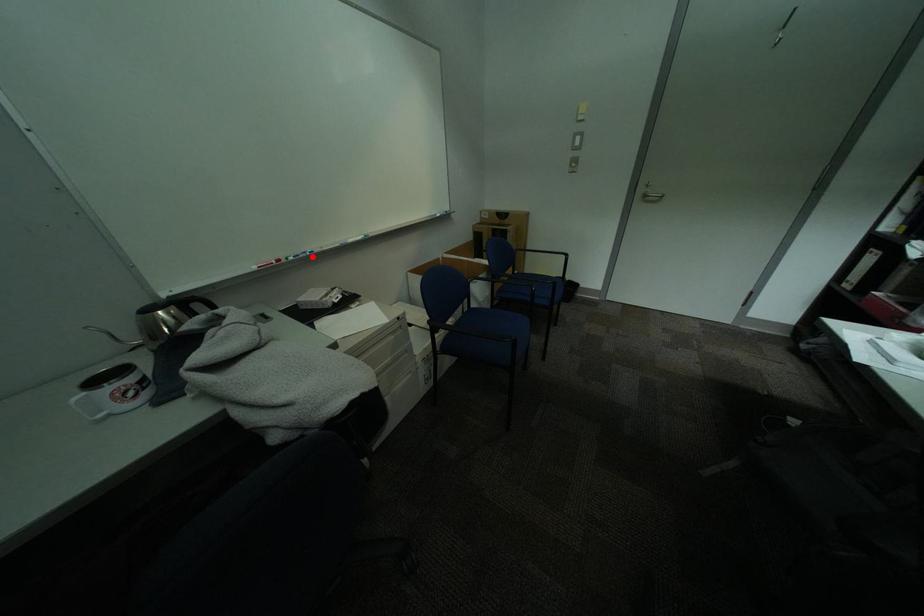
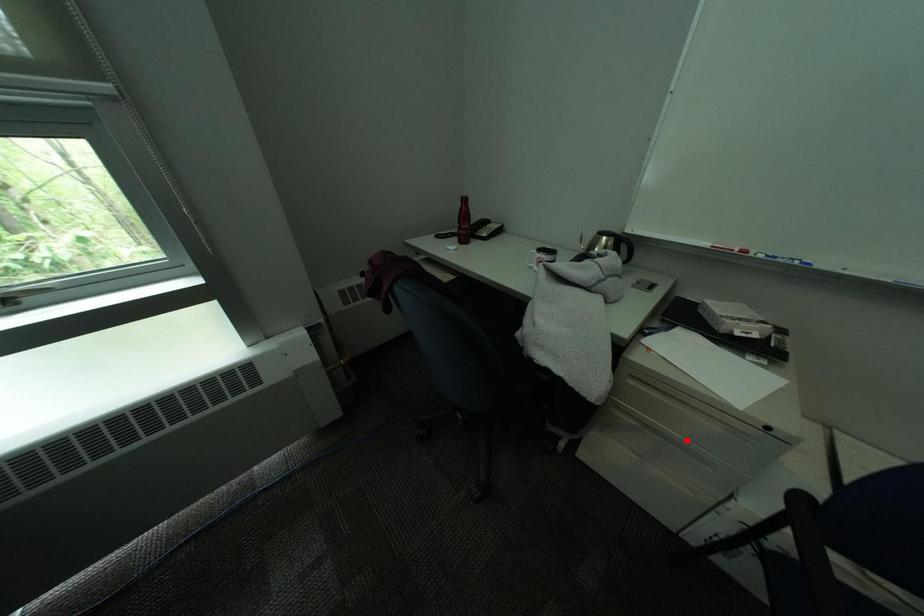
I am providing you with two images of the same scene from different viewpoints. A red point is marked on the first image and another point is marked on the second image. Is the marked point in image1 the same physical position as the marked point in image2?

No